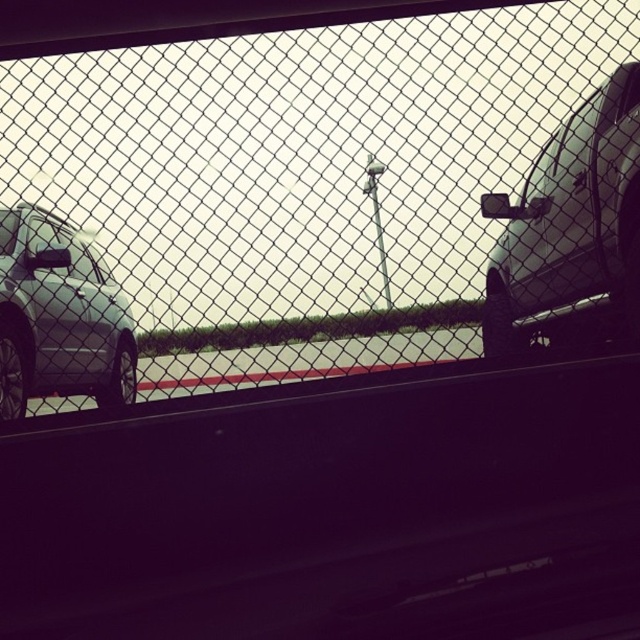
You are standing in front of the image and want to locate the wire mesh fence at center. What are the coordinates of its position?

The wire mesh fence at center is located at coordinates (301, 182).

You are standing in front of a chain link fence and see a point marked at coordinates [572,218]. According to the scene, where exactly is this point located?

The point at [572,218] is located on the satin silver car at right.

You are a delivery person trying to see if a package can be placed on top of the wire mesh fence at center without it falling off. Considering the matte silver suv at left is parked nearby, can you determine if the fence is tall enough to prevent the package from sliding off onto the car?

The wire mesh fence at center has a greater height compared to the matte silver suv at left, so the fence is tall enough to prevent the package from sliding off onto the car.